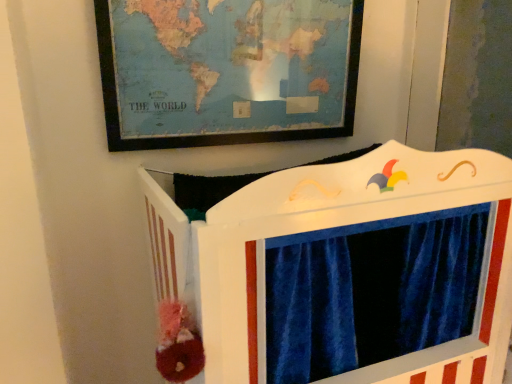
Question: Would you say white painted wood puppet theater at center is inside or outside wooden world map at upper center?

Choices:
 (A) inside
 (B) outside

Answer: (B)

Question: From their relative heights in the image, would you say white painted wood puppet theater at center is taller or shorter than wooden world map at upper center?

Choices:
 (A) tall
 (B) short

Answer: (A)

Question: From a real-world perspective, is white painted wood puppet theater at center physically located above or below wooden world map at upper center?

Choices:
 (A) above
 (B) below

Answer: (B)

Question: From the image's perspective, relative to white painted wood puppet theater at center, is wooden world map at upper center above or below?

Choices:
 (A) above
 (B) below

Answer: (A)

Question: Considering the positions of wooden world map at upper center and white painted wood puppet theater at center in the image, is wooden world map at upper center bigger or smaller than white painted wood puppet theater at center?

Choices:
 (A) big
 (B) small

Answer: (B)

Question: Based on their positions, is wooden world map at upper center located to the left or right of white painted wood puppet theater at center?

Choices:
 (A) right
 (B) left

Answer: (B)

Question: From a real-world perspective, is wooden world map at upper center physically located above or below white painted wood puppet theater at center?

Choices:
 (A) above
 (B) below

Answer: (A)